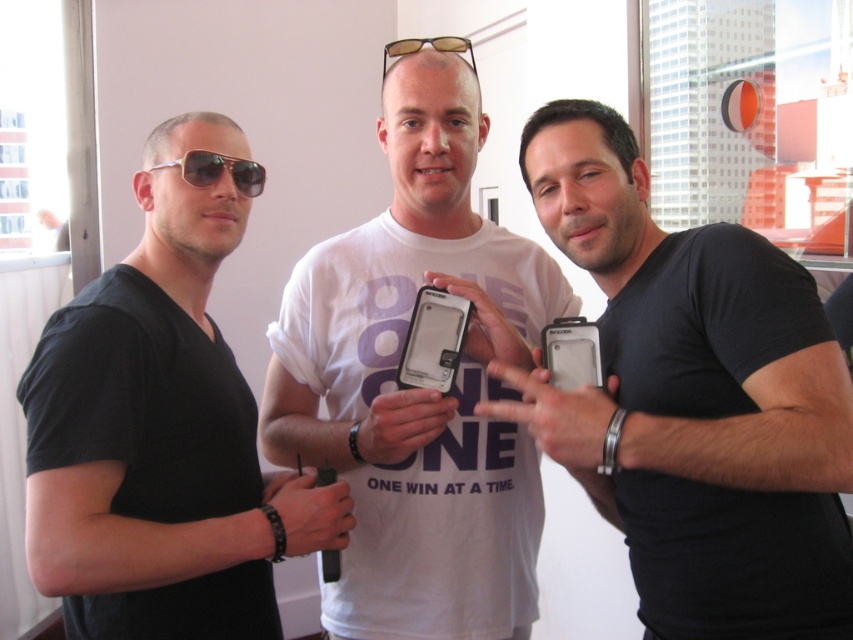
Which is below, black matte t-shirt at left or matte black sunglasses at left?

black matte t-shirt at left

Is black matte t-shirt at left further to camera compared to matte black sunglasses at left?

No.

What do you see at coordinates (161, 433) in the screenshot? I see `black matte t-shirt at left` at bounding box center [161, 433].

At what (x,y) coordinates should I click in order to perform the action: click on black matte t-shirt at left. Please return your answer as a coordinate pair (x, y). The height and width of the screenshot is (640, 853). Looking at the image, I should click on (161, 433).

Is point (416, 294) positioned behind point (567, 381)?

Yes, point (416, 294) is behind point (567, 381).

Who is positioned more to the right, clear plastic phone at center or matte black phone at center?

matte black phone at center

Is point (436, 339) closer to camera compared to point (582, 355)?

No, (436, 339) is further to viewer.

Find the location of a particular element. clear plastic phone at center is located at coordinates (433, 340).

Between black matte phone at center and black matte t-shirt at left, which one has less height?

black matte phone at center

Locate an element on the screen. The image size is (853, 640). black matte phone at center is located at coordinates (695, 397).

Who is more forward, (x=618, y=416) or (x=225, y=202)?

Positioned in front is point (x=618, y=416).

Identify the location of black matte phone at center. The height and width of the screenshot is (640, 853). (695, 397).